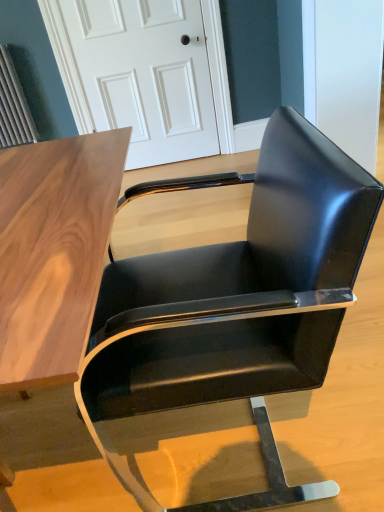
Question: Considering the positions of point (x=322, y=287) and point (x=87, y=71), is point (x=322, y=287) closer or farther from the camera than point (x=87, y=71)?

Choices:
 (A) closer
 (B) farther

Answer: (A)

Question: From the image's perspective, relative to white glossy door at upper center, is glossy black chair at center above or below?

Choices:
 (A) above
 (B) below

Answer: (B)

Question: Is glossy black chair at center inside or outside of white glossy door at upper center?

Choices:
 (A) outside
 (B) inside

Answer: (A)

Question: Based on their sizes in the image, would you say white glossy door at upper center is bigger or smaller than glossy black chair at center?

Choices:
 (A) big
 (B) small

Answer: (B)

Question: In the image, is white glossy door at upper center positioned in front of or behind glossy black chair at center?

Choices:
 (A) front
 (B) behind

Answer: (B)

Question: From the image's perspective, is white glossy door at upper center positioned above or below glossy black chair at center?

Choices:
 (A) below
 (B) above

Answer: (B)

Question: Considering the relative positions of white glossy door at upper center and glossy black chair at center in the image provided, is white glossy door at upper center to the left or to the right of glossy black chair at center?

Choices:
 (A) left
 (B) right

Answer: (A)